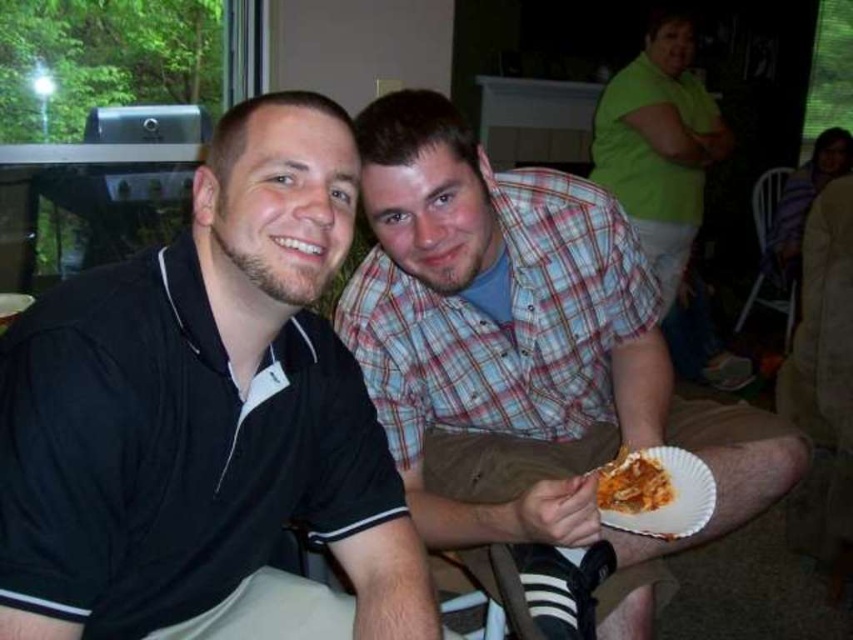
Question: Which point is farther from the camera taking this photo?

Choices:
 (A) (276, 108)
 (B) (605, 497)
 (C) (656, 435)

Answer: (C)

Question: Which of the following is the closest to the observer?

Choices:
 (A) (688, 212)
 (B) (601, 396)
 (C) (639, 488)
 (D) (28, 468)

Answer: (D)

Question: Does white paper plate at lower right have a lesser width compared to shiny orange pasta at lower right?

Choices:
 (A) yes
 (B) no

Answer: (B)

Question: Does black matte shirt at left have a lesser width compared to green matte shirt at upper right?

Choices:
 (A) yes
 (B) no

Answer: (A)

Question: Which object appears farthest from the camera in this image?

Choices:
 (A) black matte shirt at left
 (B) green matte shirt at upper right
 (C) plaid shirt at center
 (D) white paper plate at lower right

Answer: (B)

Question: Is black matte shirt at left above white paper plate at lower right?

Choices:
 (A) yes
 (B) no

Answer: (A)